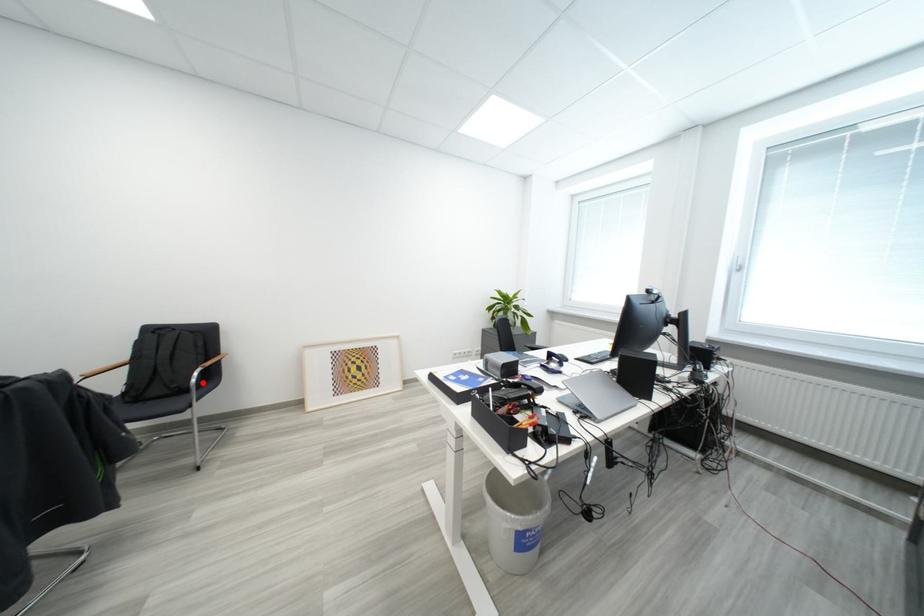
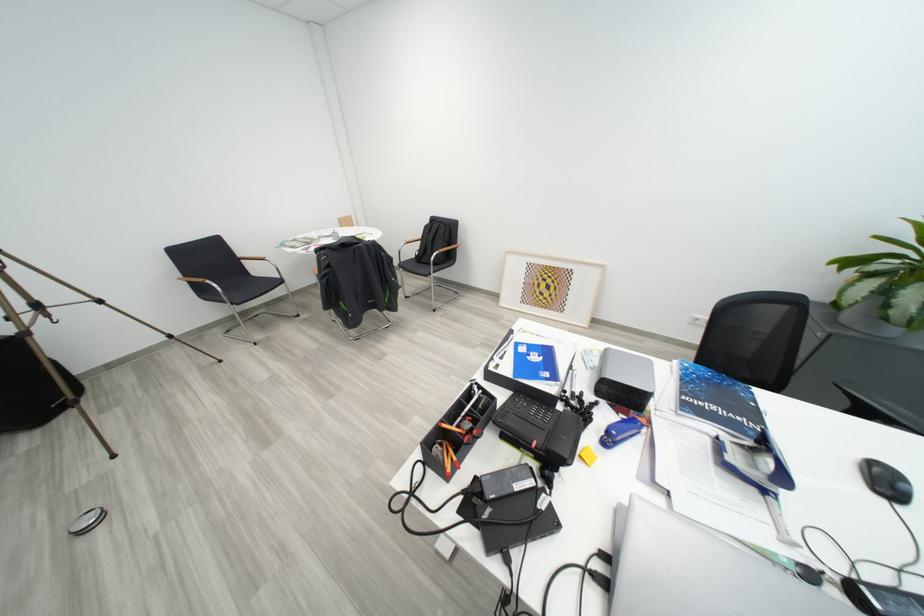
Question: A red point is marked in image1. In image2, is the corresponding 3D point closer to the camera or farther? Reply with the corresponding letter.

Choices:
 (A) The corresponding 3D point is closer.
 (B) The corresponding 3D point is farther.

Answer: (A)